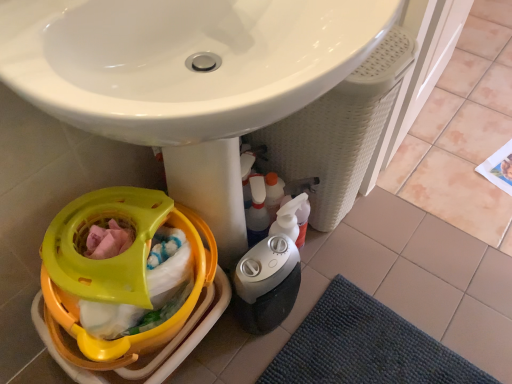
Image resolution: width=512 pixels, height=384 pixels. In order to click on free space above yellow plastic baby carriage at lower left (from a real-world perspective) in this screenshot , I will do `click(104, 242)`.